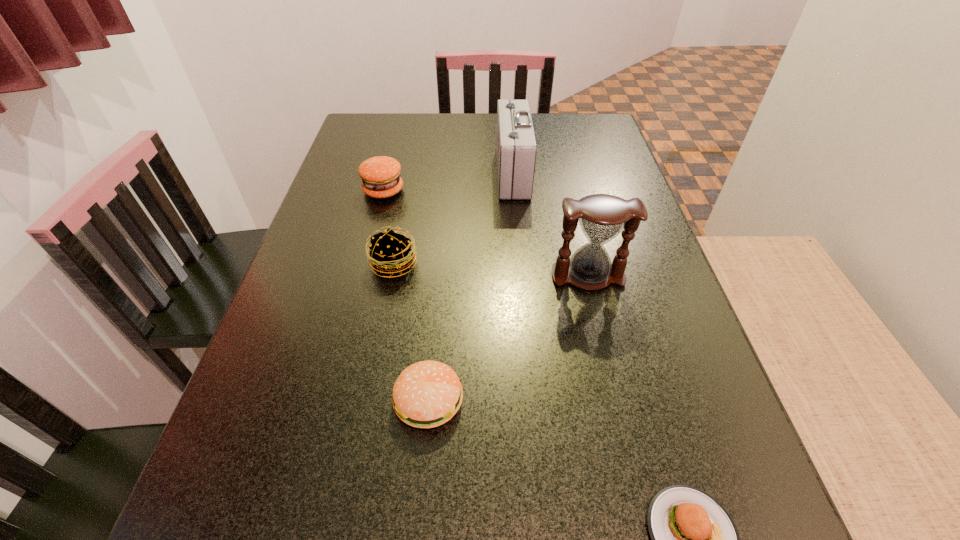
At what (x,y) coordinates should I click in order to perform the action: click on vacant space situated on the right of the third nearest food. Please return your answer as a coordinate pair (x, y). The height and width of the screenshot is (540, 960). Looking at the image, I should click on (508, 264).

At what (x,y) coordinates should I click in order to perform the action: click on free space located 0.340m on the back of the farthest food. Please return your answer as a coordinate pair (x, y). Looking at the image, I should click on (402, 118).

Find the location of `blank space located on the back of the second nearest food`. blank space located on the back of the second nearest food is located at coordinates (442, 258).

Where is `object at the far edge`? This screenshot has width=960, height=540. object at the far edge is located at coordinates (516, 148).

Where is `object that is positioned at the right edge`? Image resolution: width=960 pixels, height=540 pixels. object that is positioned at the right edge is located at coordinates (602, 217).

Image resolution: width=960 pixels, height=540 pixels. I want to click on vacant space at the far edge, so click(x=422, y=131).

You are a GUI agent. You are given a task and a screenshot of the screen. Output one action in this format:
    pyautogui.click(x=<x>, y=<y>)
    Task: Click on the vacant space at the left edge
    This screenshot has width=960, height=540.
    Given the screenshot: What is the action you would take?
    pyautogui.click(x=335, y=212)

You are a GUI agent. You are given a task and a screenshot of the screen. Output one action in this format:
    pyautogui.click(x=<x>, y=<y>)
    Task: Click on the vacant region at the right edge of the desktop
    This screenshot has width=960, height=540.
    Given the screenshot: What is the action you would take?
    pyautogui.click(x=605, y=174)

You are a GUI agent. You are given a task and a screenshot of the screen. Output one action in this format:
    pyautogui.click(x=<x>, y=<y>)
    Task: Click on the vacant space at the far right corner of the desktop
    
    Given the screenshot: What is the action you would take?
    pyautogui.click(x=571, y=132)

Locate an element on the screen. This screenshot has width=960, height=540. empty space that is in between the third object from right to left and the hourglass is located at coordinates (550, 225).